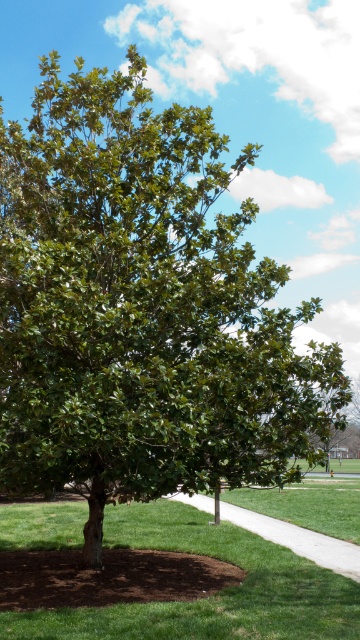
Question: Is green grass at center positioned at the back of white concrete sidewalk at lower center?

Choices:
 (A) no
 (B) yes

Answer: (A)

Question: From the image, what is the correct spatial relationship of green grass at center in relation to white concrete sidewalk at lower center?

Choices:
 (A) below
 (B) above

Answer: (B)

Question: Is green grass at center to the left of white concrete sidewalk at lower center from the viewer's perspective?

Choices:
 (A) no
 (B) yes

Answer: (B)

Question: Which point is farther to the camera?

Choices:
 (A) green grass at center
 (B) white concrete sidewalk at lower center

Answer: (B)

Question: Which point is closer to the camera taking this photo?

Choices:
 (A) (43, 534)
 (B) (335, 556)

Answer: (B)

Question: Which point is farther from the camera taking this photo?

Choices:
 (A) coord(302,540)
 (B) coord(239,593)

Answer: (A)